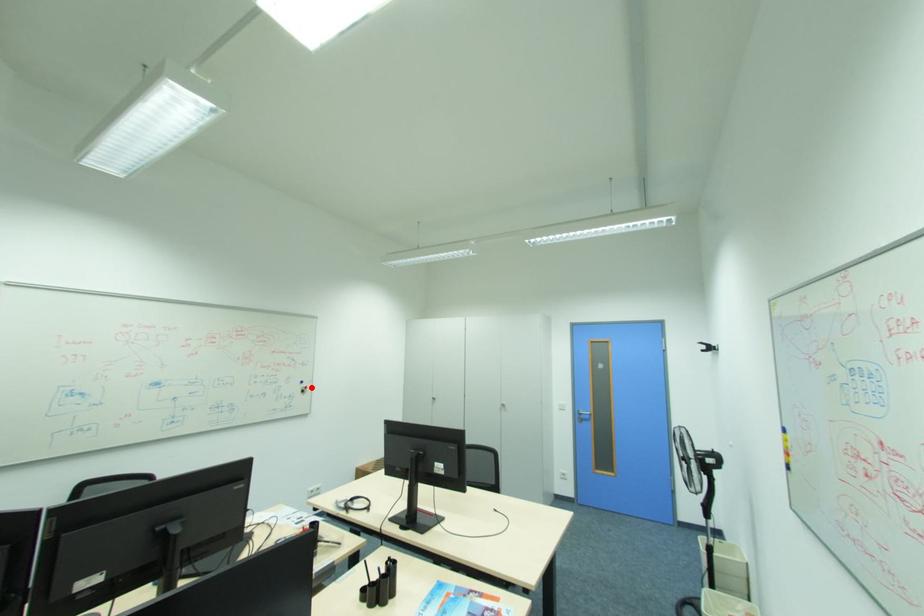
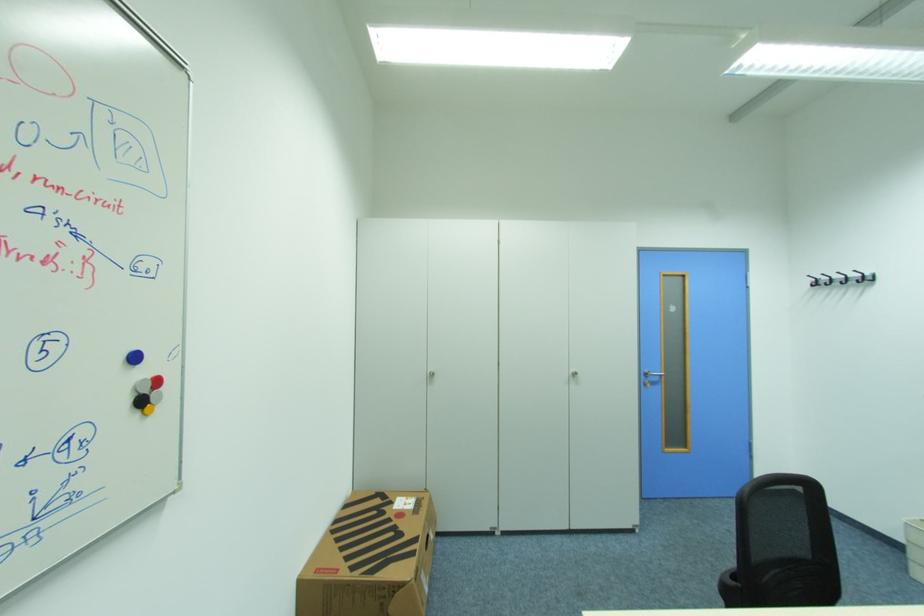
Question: I am providing you with two images of the same scene from different viewpoints. A red point is marked on the first image. Is the red point's position out of view in image 2?

Choices:
 (A) Yes
 (B) No

Answer: (B)